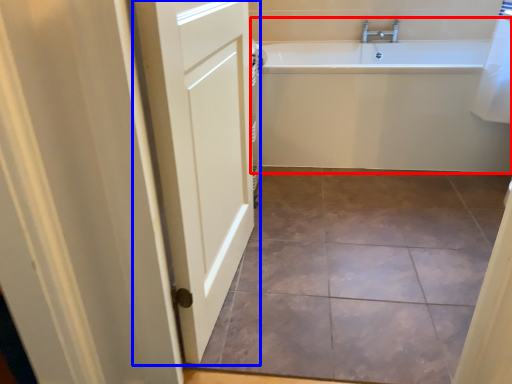
Question: Which object is closer to the camera taking this photo, bathtub (highlighted by a red box) or door (highlighted by a blue box)?

Choices:
 (A) bathtub
 (B) door

Answer: (B)